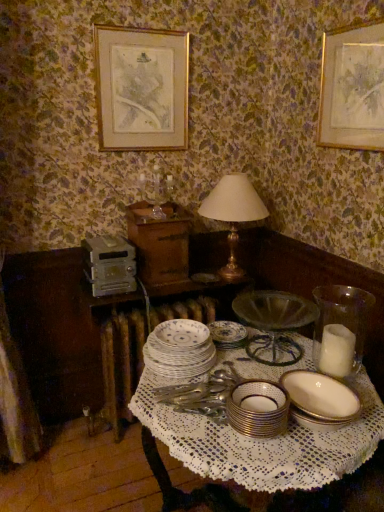
The width and height of the screenshot is (384, 512). I want to click on vacant area that lies to the right of gold metallic bowl at center, which is the 2th tableware in right-to-left order, so [306, 446].